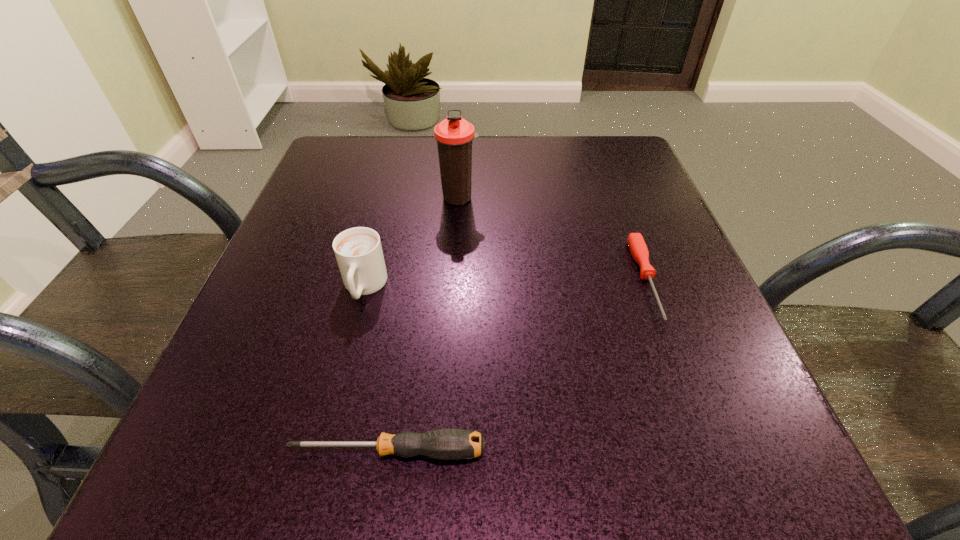
This screenshot has width=960, height=540. Find the location of `blank region between the nearest object and the shortest object`. blank region between the nearest object and the shortest object is located at coordinates (517, 365).

Identify the location of vacant area that lies between the thermos bottle and the cappuccino. (412, 242).

The width and height of the screenshot is (960, 540). In order to click on free spot between the tallest object and the left screwdriver in this screenshot , I will do (423, 325).

The width and height of the screenshot is (960, 540). In order to click on unoccupied position between the third tallest object and the cappuccino in this screenshot , I will do `click(376, 369)`.

Choose which object is the second nearest neighbor to the third shortest object. Please provide its 2D coordinates. Your answer should be formatted as a tuple, i.e. [(x, y)], where the tuple contains the x and y coordinates of a point satisfying the conditions above.

[(444, 444)]

Where is `object that stands as the second closest to the shortest object`? The height and width of the screenshot is (540, 960). object that stands as the second closest to the shortest object is located at coordinates (444, 444).

Locate an element on the screen. The height and width of the screenshot is (540, 960). vacant region that satisfies the following two spatial constraints: 1. on the side with the handle of the cappuccino; 2. on the right side of the taller screwdriver is located at coordinates (322, 451).

Locate an element on the screen. The width and height of the screenshot is (960, 540). free spot that satisfies the following two spatial constraints: 1. on the side with the handle of the third shortest object; 2. on the left side of the nearest object is located at coordinates (322, 451).

You are a GUI agent. You are given a task and a screenshot of the screen. Output one action in this format:
    pyautogui.click(x=<x>, y=<y>)
    Task: Click on the free point that satisfies the following two spatial constraints: 1. on the side with the handle of the nearer screwdriver; 2. on the right side of the cappuccino
    This screenshot has height=540, width=960.
    Given the screenshot: What is the action you would take?
    pyautogui.click(x=322, y=451)